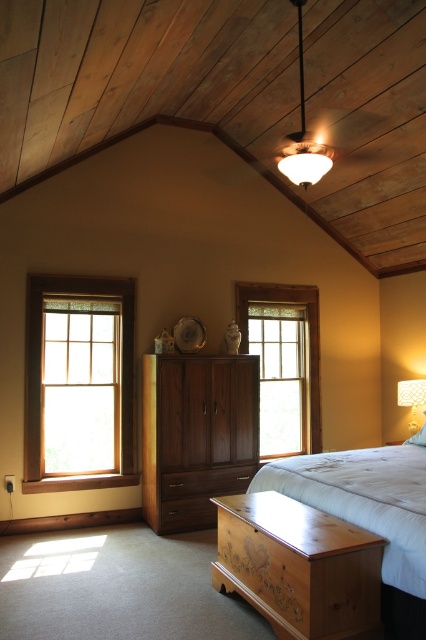
Question: Which object is the farthest from the dark wood drawer at center?

Choices:
 (A) clear glass window at center
 (B) walnut wood cabinet at center

Answer: (A)

Question: Which point is farther from the camera taking this photo?

Choices:
 (A) (302, 83)
 (B) (129, 368)
 (C) (184, 416)
 (D) (416, 420)

Answer: (D)

Question: Can you confirm if walnut wood cabinet at center is wider than matte glass pendant light at upper center?

Choices:
 (A) no
 (B) yes

Answer: (B)

Question: Considering the real-world distances, which object is closest to the light brown wooden window at left?

Choices:
 (A) walnut wood cabinet at center
 (B) matte white lampshade at right
 (C) matte glass pendant light at upper center
 (D) dark wood drawer at center

Answer: (A)

Question: Can you confirm if walnut wood cabinet at center is wider than clear glass window at center?

Choices:
 (A) yes
 (B) no

Answer: (A)

Question: Can you confirm if walnut wood cabinet at center is positioned below white matte bed at center?

Choices:
 (A) no
 (B) yes

Answer: (A)